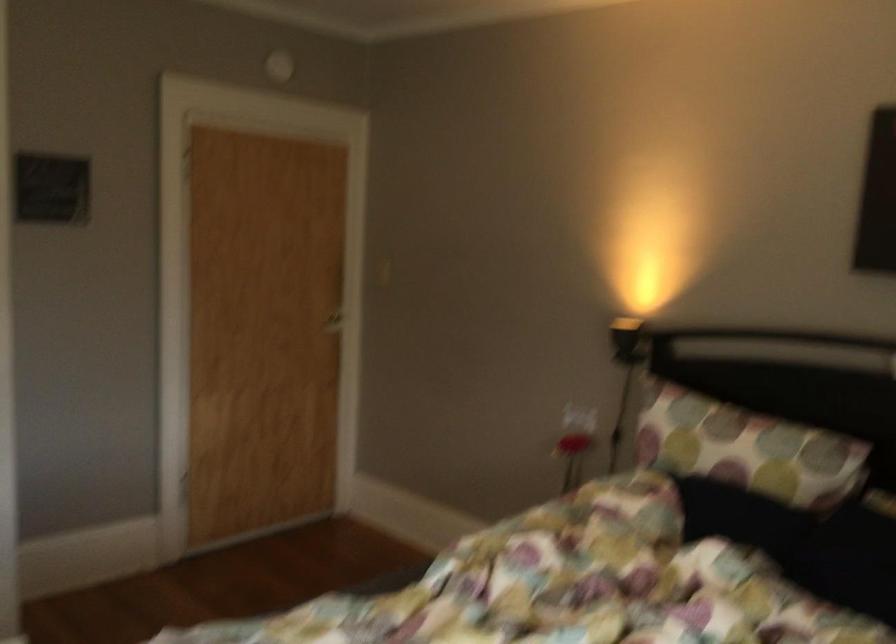
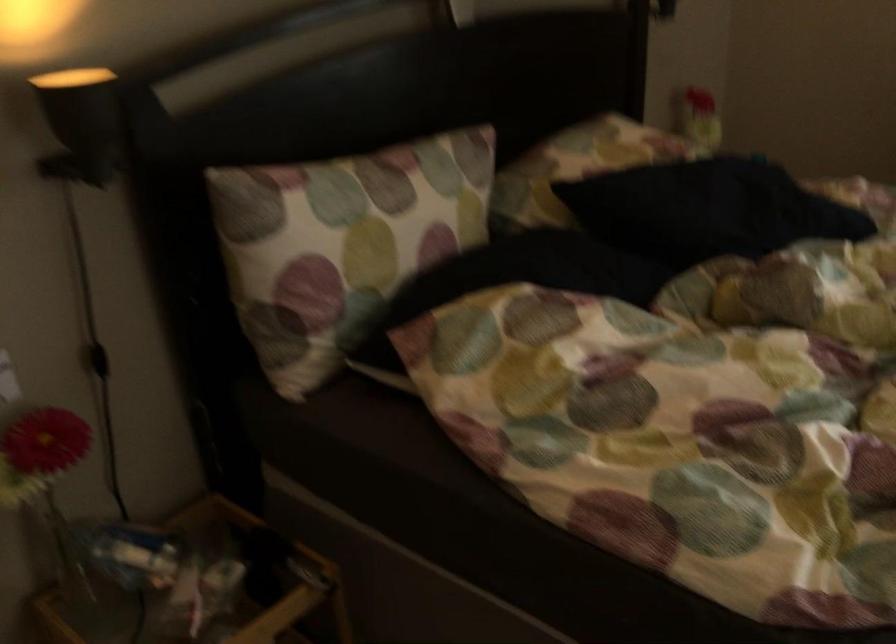
Where in the second image is the point corresponding to [625,436] from the first image?

(98, 360)